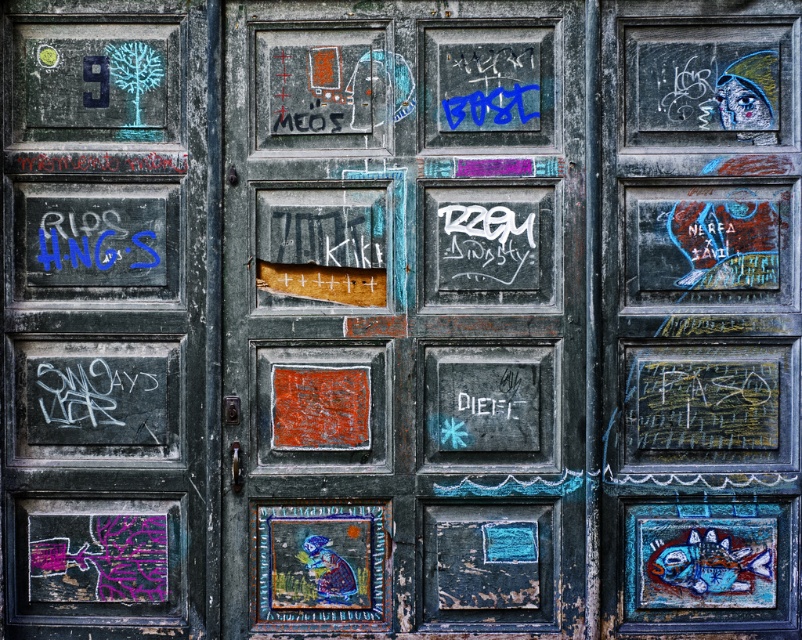
How much distance is there between rusty metal door at center and chalky green door at left?

43.99 centimeters

Who is lower down, rusty metal door at center or chalky green door at left?

chalky green door at left

Between point (543, 112) and point (136, 456), which one is positioned in front?

Positioned in front is point (543, 112).

Find the location of a particular element. This screenshot has width=802, height=640. rusty metal door at center is located at coordinates (403, 317).